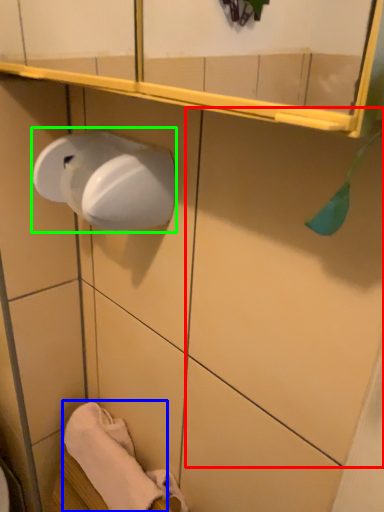
Question: Which object is positioned closest to tile (highlighted by a red box)? Select from bath towel (highlighted by a blue box) and paper towel (highlighted by a green box).

Choices:
 (A) bath towel
 (B) paper towel

Answer: (B)